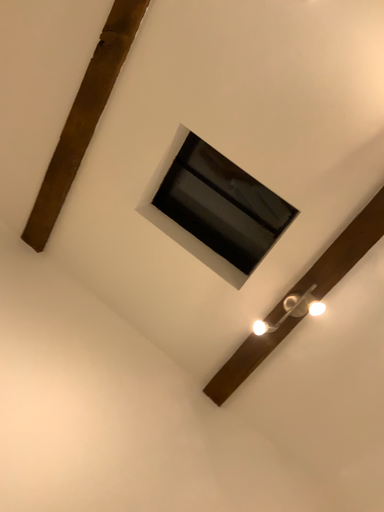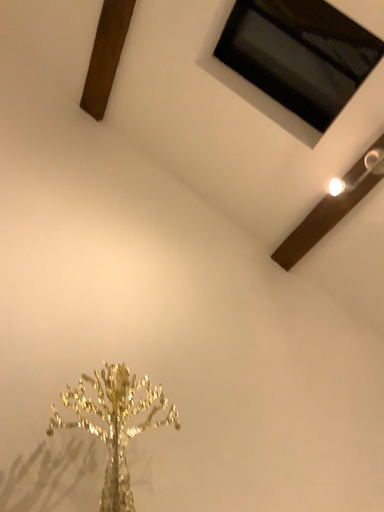
Question: How did the camera likely rotate when shooting the video?

Choices:
 (A) rotated left
 (B) rotated right

Answer: (A)